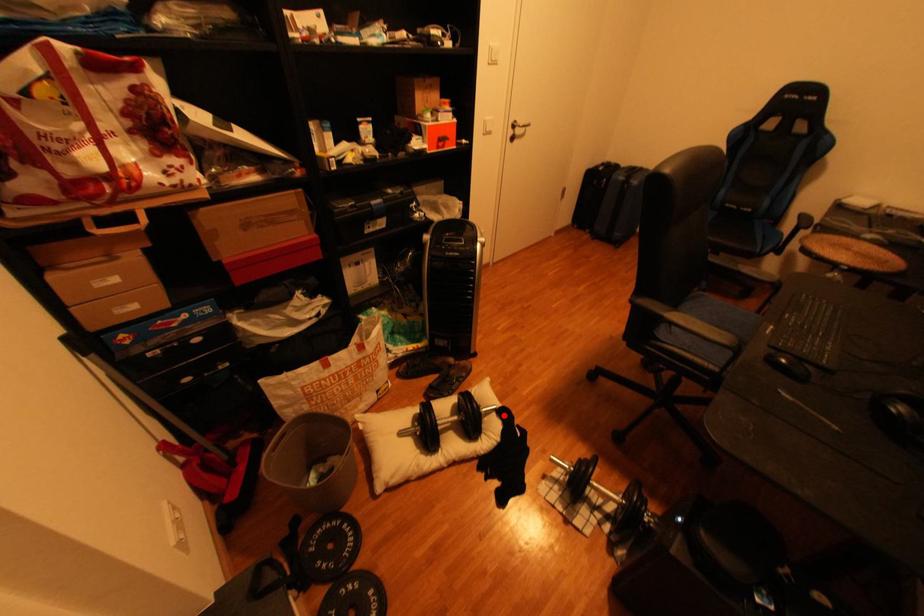
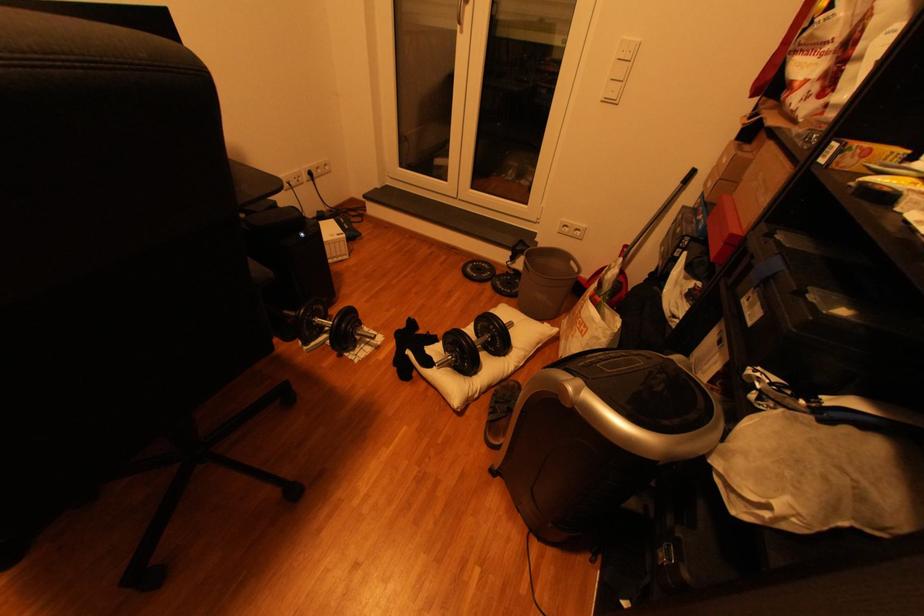
Find the pixel in the second image that matches the highlighted location in the first image.

(445, 361)